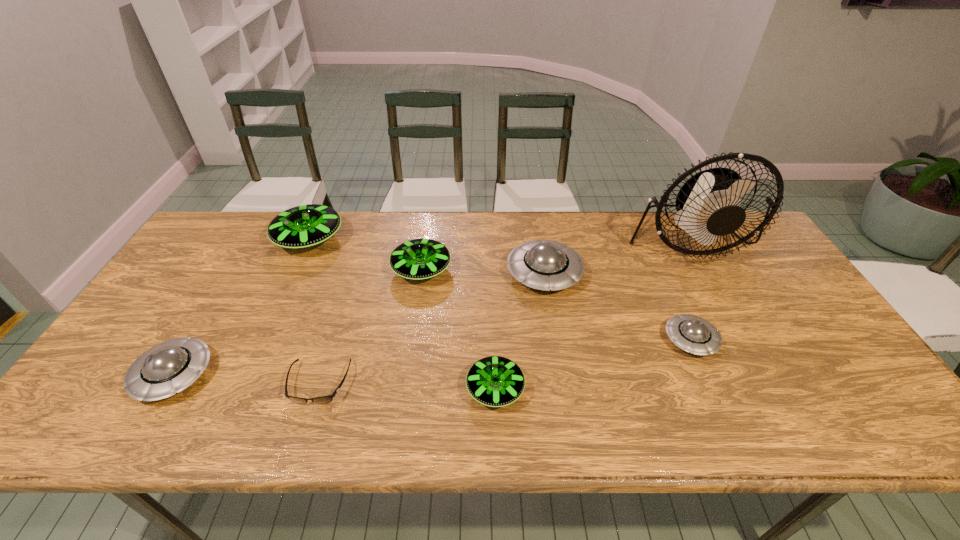
You are a GUI agent. You are given a task and a screenshot of the screen. Output one action in this format:
    pyautogui.click(x=<x>, y=<y>)
    Task: Click on the closest gray saucer relative to the farthest gray saucer
    
    Given the screenshot: What is the action you would take?
    pyautogui.click(x=693, y=334)

Find the location of a particular element. free spot that satisfies the following two spatial constraints: 1. on the back side of the leftmost green saucer; 2. on the left side of the second smallest gray saucer is located at coordinates (255, 240).